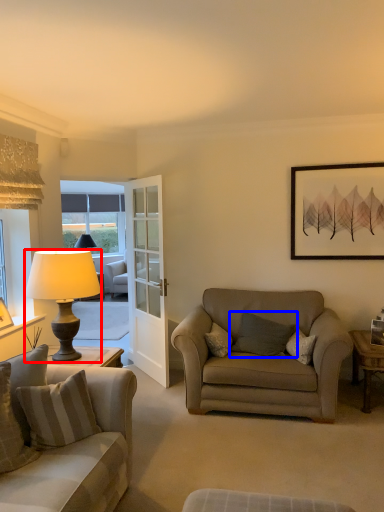
Question: Which object is further to the camera taking this photo, lamp (highlighted by a red box) or pillow (highlighted by a blue box)?

Choices:
 (A) lamp
 (B) pillow

Answer: (B)